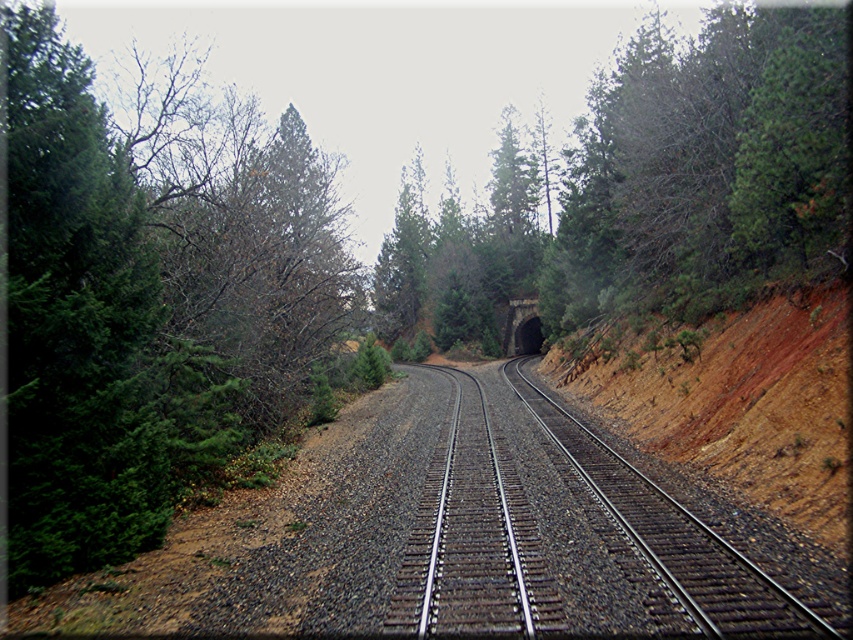
You are standing at the point marked as point (x=648, y=188). What object is located exactly at your current position?

The green textured tree at center is located exactly at point 0.291, 0.761.

You are standing at the point labeled as point (587, 522) in the image. What is the material of the surface you are currently standing on?

The point (587, 522) indicates metal smooth train tracks at center, so the surface is made of metal.